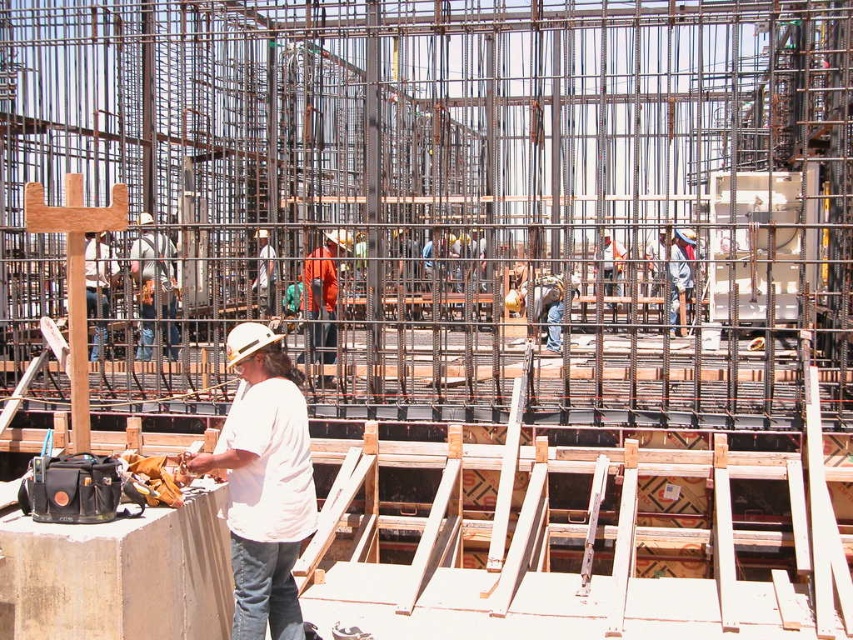
You are a construction worker at the site. You need to locate the orange fabric safety vest at center. Where is the point with coordinates point (322, 296) located?

The point (322, 296) is located on the orange fabric safety vest at center.

You are a safety inspector at the construction site. You notice two orange safety vests in the scene. The first is labeled as orange safety vest at center, and the second is labeled as orange fabric safety vest at center. According to safety regulations, all safety vests must be within 5 meters of each other to ensure quick access during emergencies. Are these two vests compliant with the regulation?

The orange safety vest at center and orange fabric safety vest at center are 6.87 meters apart from each other, which exceeds the 5 meter requirement. Therefore, they are not compliant with the safety regulation.